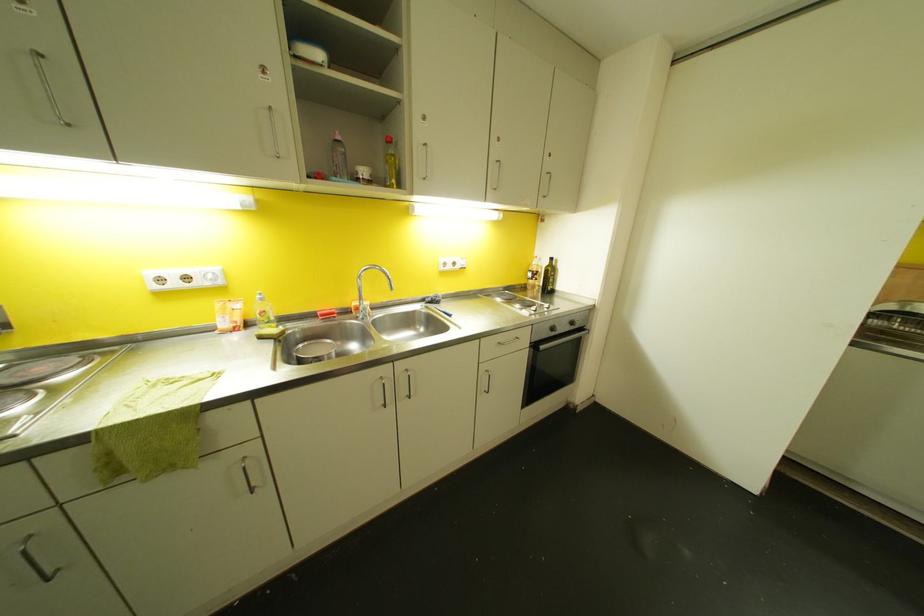
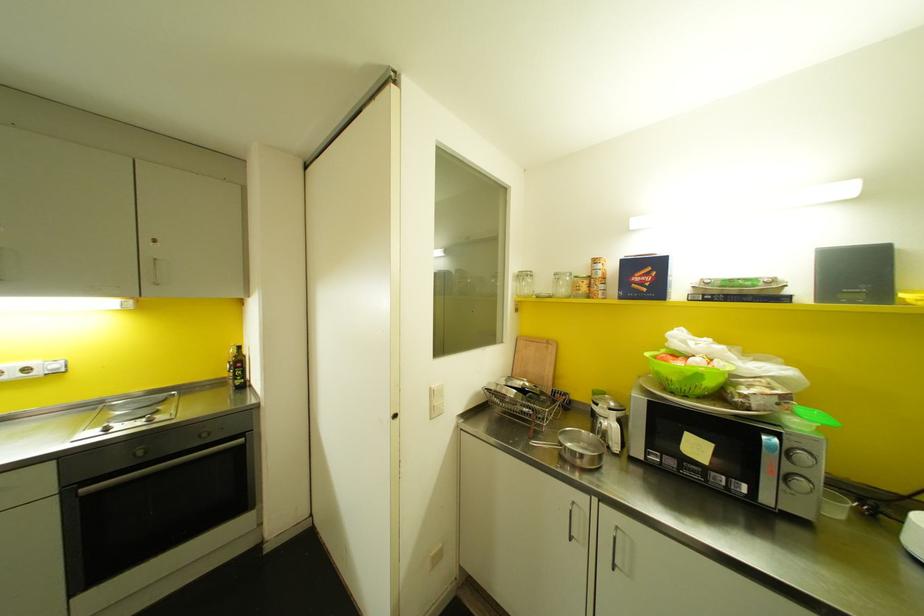
Where in the second image is the point corresponding to point 551,280 from the first image?

(237, 371)